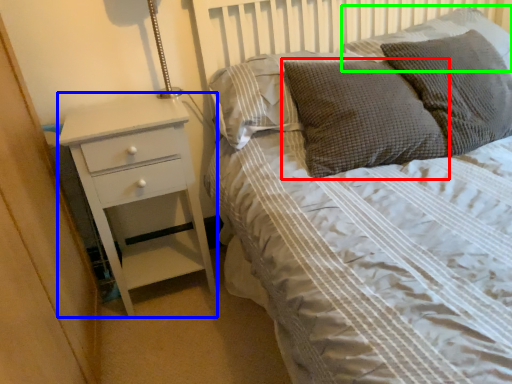
Question: Considering the real-world distances, which object is closest to pillow (highlighted by a red box)? chest of drawers (highlighted by a blue box) or pillow (highlighted by a green box).

Choices:
 (A) chest of drawers
 (B) pillow

Answer: (B)